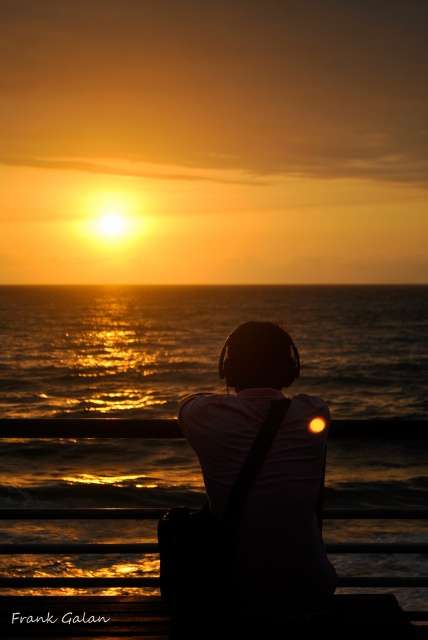
You are a photographer trying to capture the sunset reflection on the water. You have a camera with a wide lens that can focus on objects at different distances. Which object between the shiny golden water at center and the black matte headphones at center should you focus on to ensure the reflection of the sunset is sharp?

You should focus on the shiny golden water at center because the black matte headphones at center is behind it, meaning the water is closer to the camera and the reflection is on the water surface.

You are standing at the edge of the sea and see the shiny golden water at center and the black matte headphones at center. Which object is closer to your left side?

The shiny golden water at center is closer to your left side since it is positioned to the left of the black matte headphones at center.